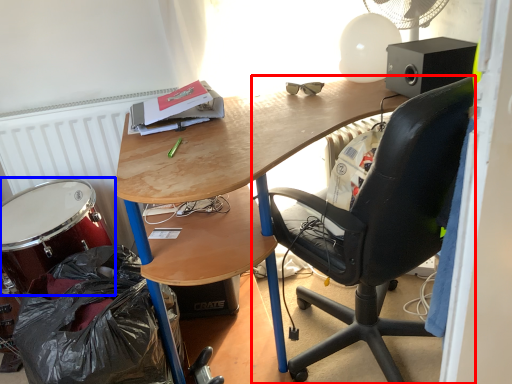
Question: Which object appears farthest to the camera in this image, chair (highlighted by a red box) or drum (highlighted by a blue box)?

Choices:
 (A) chair
 (B) drum

Answer: (B)